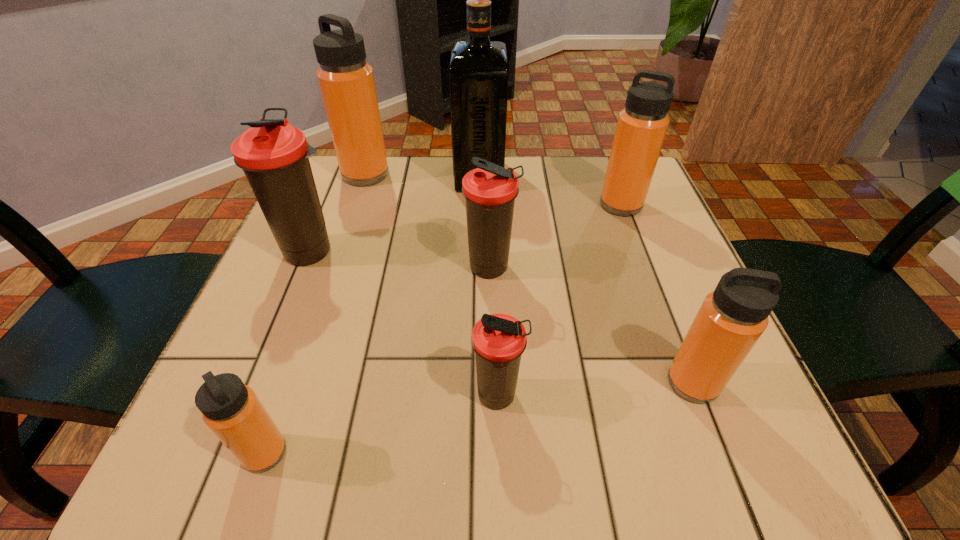
Where is `object that stands as the second closest to the leftmost brown thermos bottle`? The image size is (960, 540). object that stands as the second closest to the leftmost brown thermos bottle is located at coordinates (490, 190).

Select which thermos bottle is the second closest to the third biggest orange thermos bottle. Please provide its 2D coordinates. Your answer should be formatted as a tuple, i.e. [(x, y)], where the tuple contains the x and y coordinates of a point satisfying the conditions above.

[(490, 190)]

You are a GUI agent. You are given a task and a screenshot of the screen. Output one action in this format:
    pyautogui.click(x=<x>, y=<y>)
    Task: Click on the sixth closest thermos bottle to the nearest brown thermos bottle
    The image size is (960, 540).
    Given the screenshot: What is the action you would take?
    pyautogui.click(x=346, y=81)

I want to click on the second closest orange thermos bottle to the second smallest brown thermos bottle, so click(732, 318).

Identify the location of orange thermos bottle that is the third closest to the third nearest orange thermos bottle. (232, 410).

Where is `brown thermos bottle that is the second nearest to the farthest thermos bottle`? The width and height of the screenshot is (960, 540). brown thermos bottle that is the second nearest to the farthest thermos bottle is located at coordinates (490, 190).

Locate an element on the screen. The width and height of the screenshot is (960, 540). brown thermos bottle that is the third closest to the liquor is located at coordinates (499, 340).

I want to click on vacant area in the image that satisfies the following two spatial constraints: 1. on the front label of the liquor; 2. on the back side of the second biggest brown thermos bottle, so click(x=478, y=269).